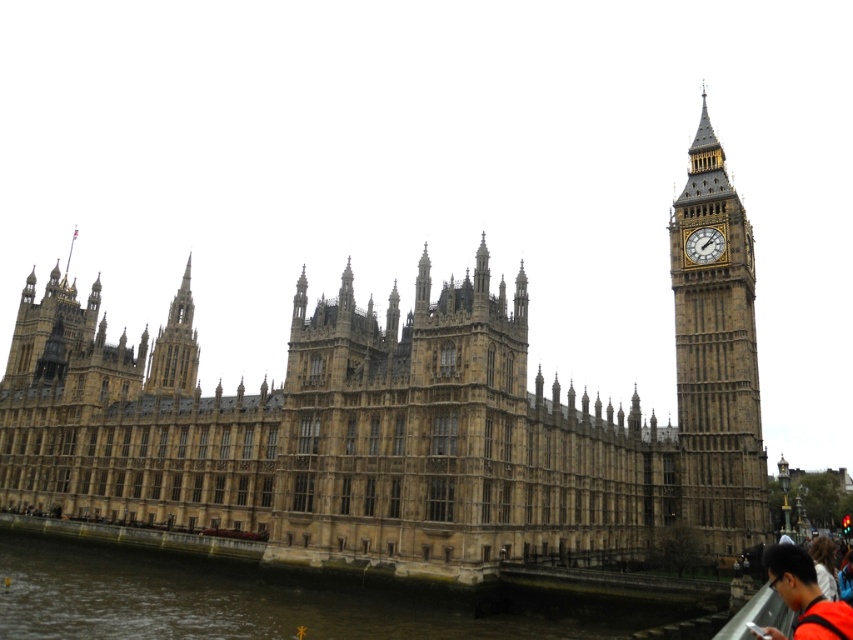
In the scene shown: Between brown water at lower left and orange fabric shirt at lower right, which one appears on the left side from the viewer's perspective?

brown water at lower left

Locate an element on the screen. This screenshot has width=853, height=640. brown water at lower left is located at coordinates (285, 602).

Where is `brown water at lower left`? brown water at lower left is located at coordinates (285, 602).

Which of these two, brown water at lower left or gold metallic clock at right, stands shorter?

Standing shorter between the two is brown water at lower left.

Is brown water at lower left closer to the viewer compared to gold metallic clock at right?

Yes, brown water at lower left is closer to the viewer.

Is point (119, 618) less distant than point (720, 236)?

That is True.

At what (x,y) coordinates should I click in order to perform the action: click on brown water at lower left. Please return your answer as a coordinate pair (x, y). This screenshot has height=640, width=853. Looking at the image, I should click on (285, 602).

Does point (251, 570) come closer to viewer compared to point (177, 362)?

Yes, it is in front of point (177, 362).

Describe the element at coordinates (285, 602) in the screenshot. I see `brown water at lower left` at that location.

Who is more distant from viewer, (715, 627) or (186, 288)?

The point (186, 288) is more distant.

At what (x,y) coordinates should I click in order to perform the action: click on brown water at lower left. Please return your answer as a coordinate pair (x, y). The image size is (853, 640). Looking at the image, I should click on (285, 602).